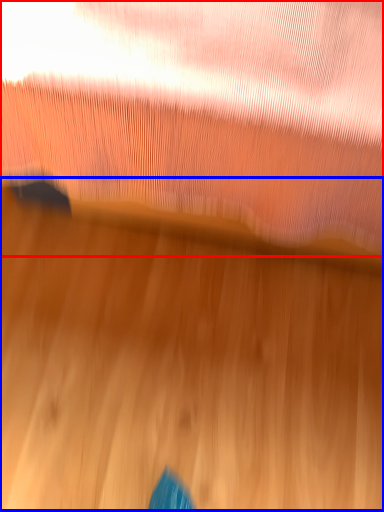
Question: Among these objects, which one is nearest to the camera, curtain (highlighted by a red box) or wood (highlighted by a blue box)?

Choices:
 (A) curtain
 (B) wood

Answer: (A)